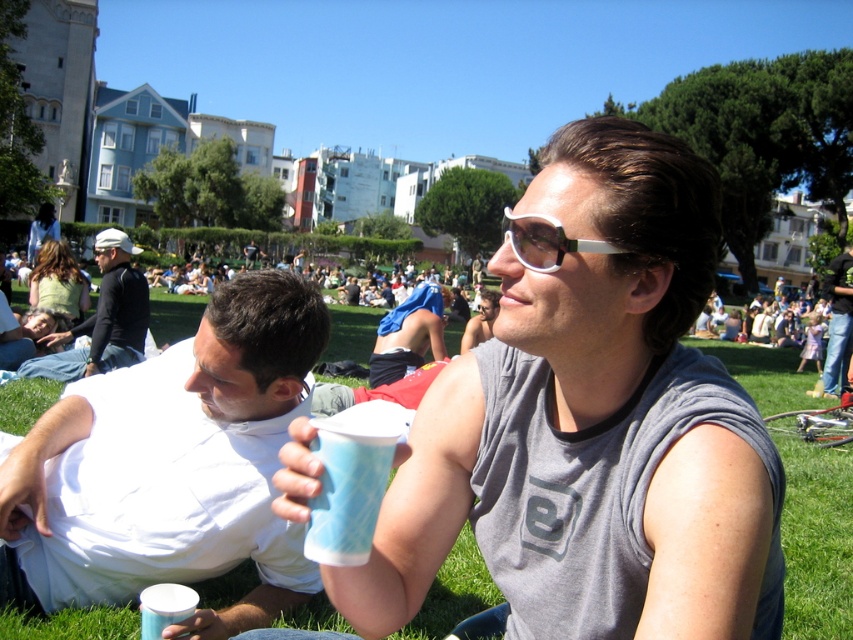
Between point (844, 545) and point (109, 308), which one is positioned in front?

Point (844, 545) is more forward.

Who is positioned more to the right, green grass at center or dark gray sweater at center?

green grass at center

Identify the location of green grass at center. Image resolution: width=853 pixels, height=640 pixels. (817, 540).

Can you confirm if matte plastic cup at center is positioned to the left of green grass at center?

Indeed, matte plastic cup at center is positioned on the left side of green grass at center.

Who is lower down, matte plastic cup at center or green grass at center?

green grass at center

At what (x,y) coordinates should I click in order to perform the action: click on matte plastic cup at center. Please return your answer as a coordinate pair (x, y). Looking at the image, I should click on (592, 426).

This screenshot has width=853, height=640. I want to click on matte plastic cup at center, so click(x=592, y=426).

Measure the distance between point (720,358) and camera.

The distance of point (720,358) from camera is 41.62 meters.

Who is more distant from viewer, (764,365) or (387,349)?

Positioned behind is point (764,365).

You are a GUI agent. You are given a task and a screenshot of the screen. Output one action in this format:
    pyautogui.click(x=<x>, y=<y>)
    Task: Click on the green grass at center
    This screenshot has width=853, height=640.
    Given the screenshot: What is the action you would take?
    pyautogui.click(x=817, y=540)